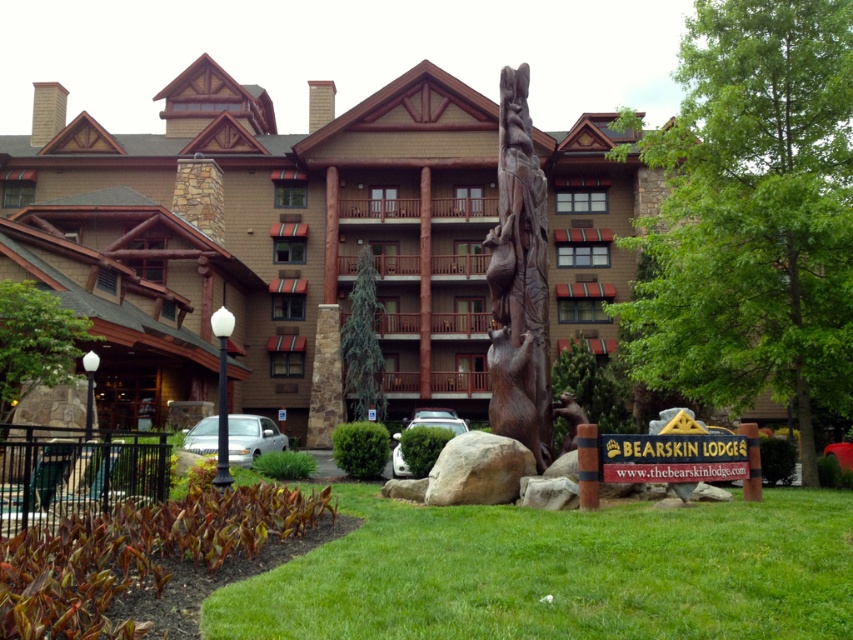
Question: Which point appears farthest from the camera in this image?

Choices:
 (A) (25, 330)
 (B) (479, 497)
 (C) (809, 589)
 (D) (511, 328)

Answer: (A)

Question: Considering the relative positions of brown wooden hotel at center and green leafy tree at center in the image provided, where is brown wooden hotel at center located with respect to green leafy tree at center?

Choices:
 (A) left
 (B) right

Answer: (A)

Question: Is brown wooden hotel at center to the right of gray rough rock at center from the viewer's perspective?

Choices:
 (A) no
 (B) yes

Answer: (A)

Question: Which of the following is the farthest from the observer?

Choices:
 (A) (100, 248)
 (B) (799, 317)
 (C) (347, 506)

Answer: (A)

Question: Does brown wooden hotel at center have a greater width compared to gray rough rock at center?

Choices:
 (A) yes
 (B) no

Answer: (A)

Question: Based on their relative distances, which object is farther from the green leafy tree at center?

Choices:
 (A) gray rough rock at center
 (B) green textured tree at center
 (C) wooden carving of bear at center
 (D) white ceramic lamp post at left

Answer: (B)